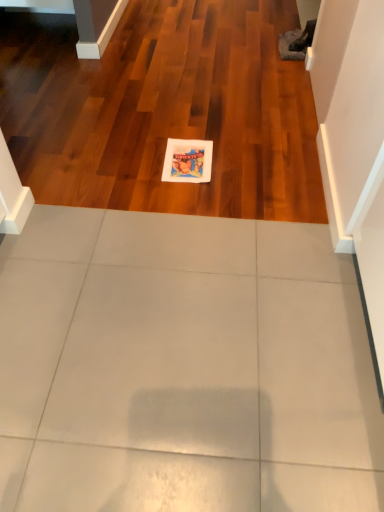
You are a GUI agent. You are given a task and a screenshot of the screen. Output one action in this format:
    pyautogui.click(x=<x>, y=<y>)
    Task: Click on the vacant space in front of matte paper postcard at center
    This screenshot has height=512, width=384.
    Given the screenshot: What is the action you would take?
    pyautogui.click(x=185, y=195)